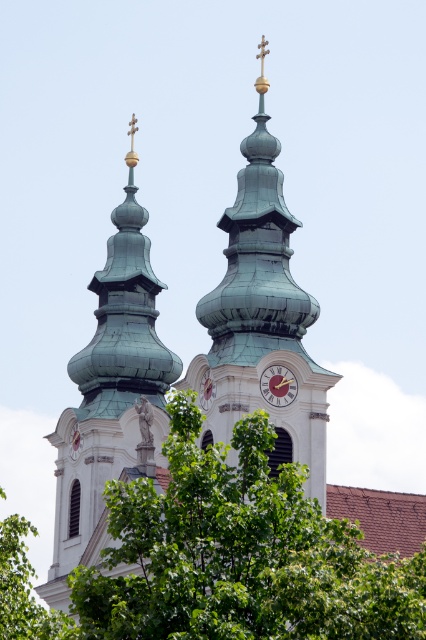
You are standing in front of the church and want to take a photo of both the green leafy tree at center and the green copper tower at left. Which object will appear larger in the photo?

The green leafy tree at center will appear larger in the photo because it is closer to the viewer than the green copper tower at left.

You are standing in front of the church and notice both the green leafy tree at center and the green copper clock tower at center. Which object is positioned to the right side from your perspective?

The green leafy tree at center is positioned to the right of the green copper clock tower at center, so the green leafy tree at center is on the right side.

You are a photographer planning to capture a wide shot of the green copper tower at left and the green leafy tree at center. Based on their sizes, which object should you prioritize positioning closer to the camera to ensure both fit within the frame?

The green leafy tree at center has a larger width than the green copper tower at left, so you should position the green leafy tree at center closer to the camera to ensure both fit within the frame.